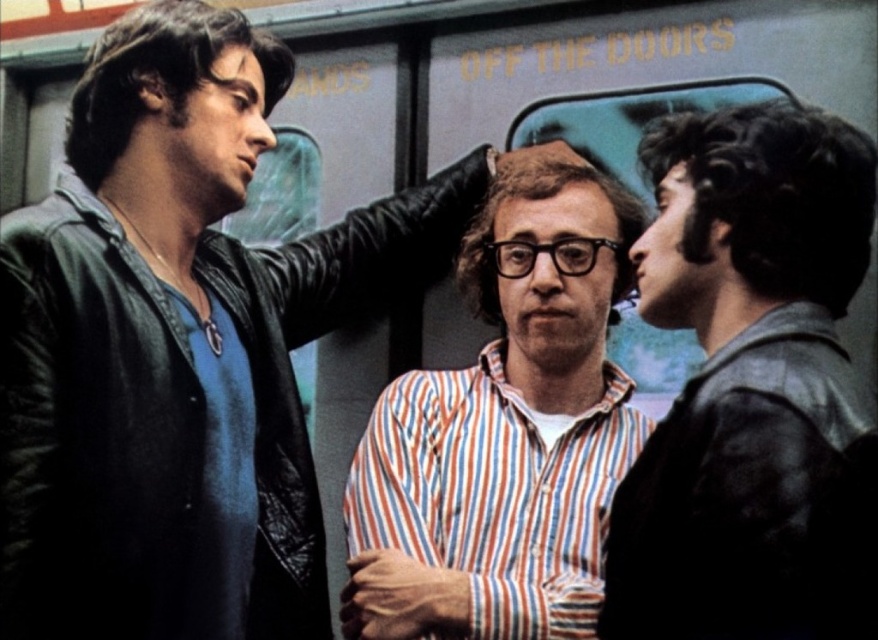
You are designing a clothing catalog layout and need to place the matte black leather jacket at left and striped cotton shirt at center side by side. Based on their widths, which should be placed on the left to maintain visual balance?

The matte black leather jacket at left should be placed on the left side in the catalog layout because its width surpasses that of the striped cotton shirt at center, creating a balanced arrangement.

You are a photographer standing in the subway car and want to take a photo of both the matte black leather jacket at left and the striped cotton shirt at center. The minimum distance your camera can focus on two subjects is 1.2 meters. Will both subjects be in focus?

The matte black leather jacket at left and striped cotton shirt at center are 1.13 meters apart from each other, which is less than the camera minimum focusing distance of 1.2 meters. Therefore, both subjects will be in focus.

You are a fashion designer observing the subway car scene. You need to determine the spatial arrangement of the two leather jackets. Which jacket is closer to you, the matte black leather jacket at left or the dark gray leather jacket at right?

The matte black leather jacket at left is closer to you because the dark gray leather jacket at right is behind it.